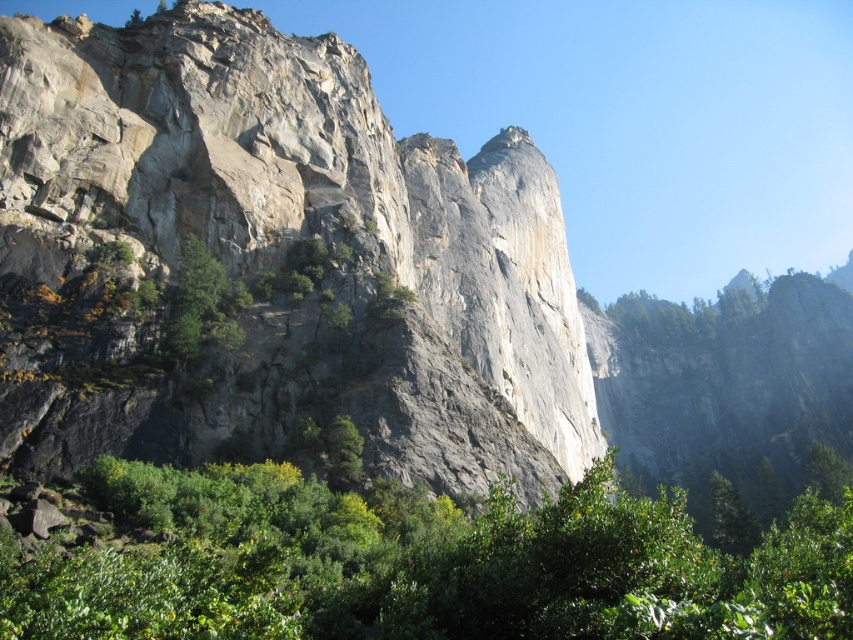
The image size is (853, 640). In order to click on gray rock formation at center in this screenshot , I will do pos(276,260).

Between point (370, 316) and point (165, 336), which one is positioned in front?

Point (165, 336) is in front.

The height and width of the screenshot is (640, 853). I want to click on gray rock formation at center, so click(276, 260).

At what (x,y) coordinates should I click in order to perform the action: click on green matte tree at left. Please return your answer as a coordinate pair (x, y). The image size is (853, 640). Looking at the image, I should click on (202, 305).

This screenshot has height=640, width=853. Describe the element at coordinates (202, 305) in the screenshot. I see `green matte tree at left` at that location.

Where is `green matte tree at left`? green matte tree at left is located at coordinates (202, 305).

The image size is (853, 640). I want to click on green matte tree at left, so click(202, 305).

Does point (456, 554) come behind point (729, 486)?

No, (456, 554) is closer to viewer.

Between point (206, 618) and point (733, 515), which one is positioned in front?

Point (206, 618) is more forward.

Who is more forward, (554, 636) or (718, 474)?

Point (554, 636) is more forward.

Identify the location of green leafy shrubs at lower center. (422, 564).